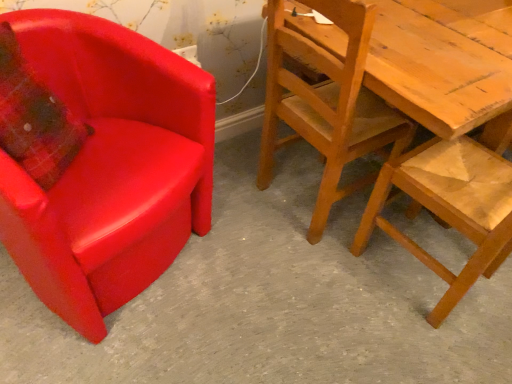
This screenshot has height=384, width=512. What are the coordinates of `vacant space underneath wooden textured chair at right, which is the 1th chair from right to left (from a real-world perspective)` in the screenshot? It's located at (424, 266).